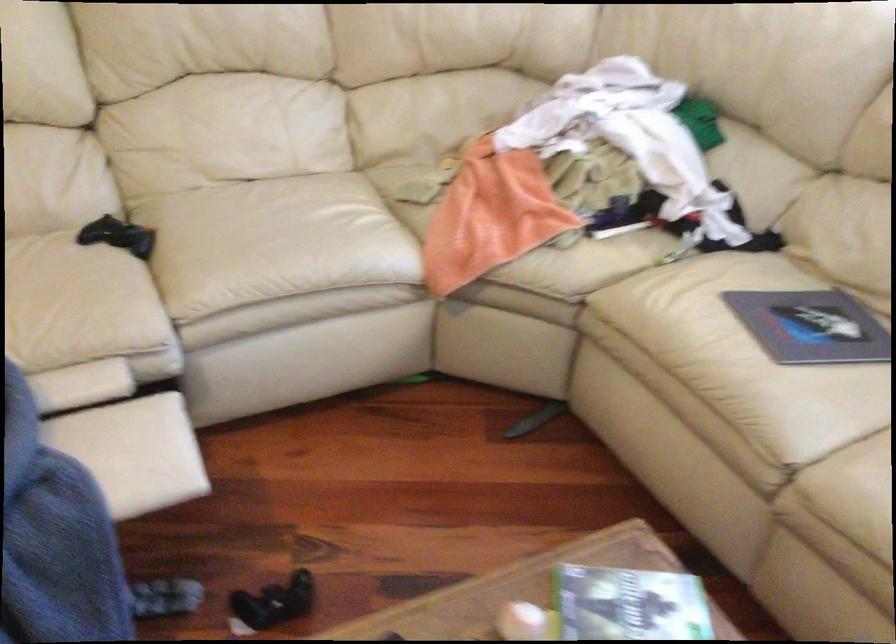
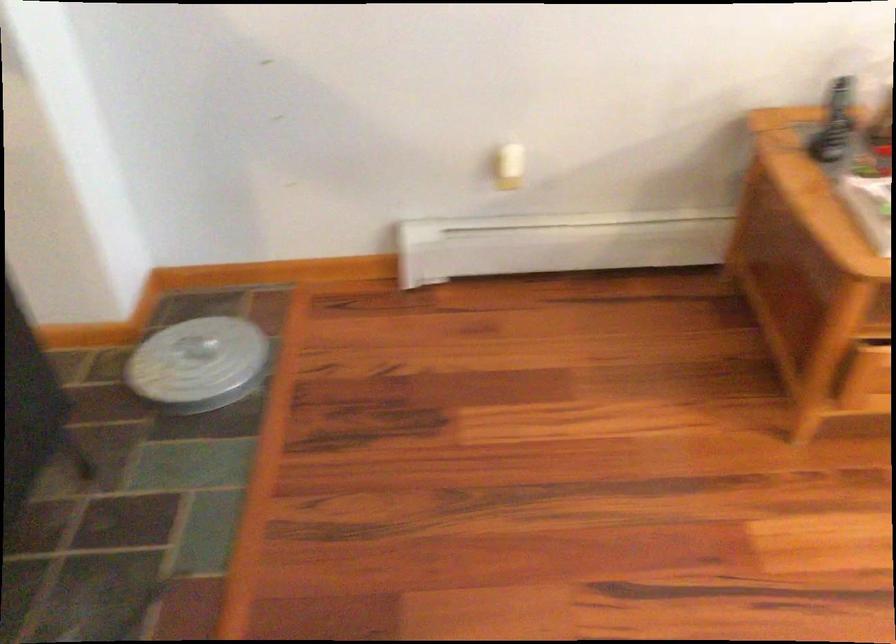
Which direction would the cameraman need to move to produce the second image?

The movement direction of the cameraman is left, forward.